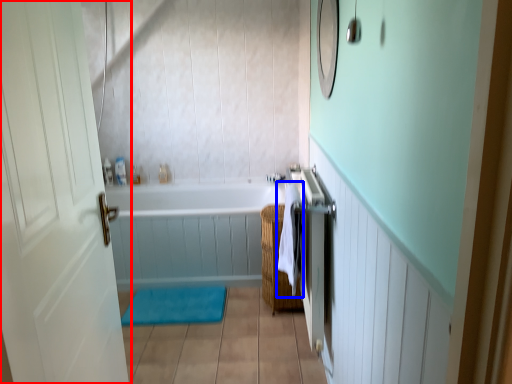
Question: Which object appears closest to the camera in this image, door (highlighted by a red box) or beach towel (highlighted by a blue box)?

Choices:
 (A) door
 (B) beach towel

Answer: (A)